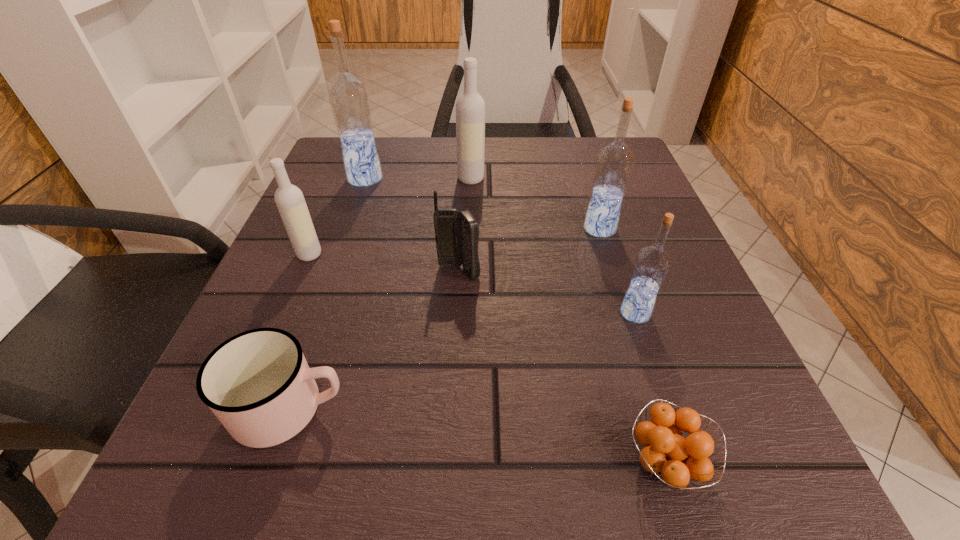
Locate an element on the screen. The width and height of the screenshot is (960, 540). cellular telephone is located at coordinates (457, 233).

I want to click on the second shortest object, so click(x=258, y=384).

At what (x,y) coordinates should I click in order to perform the action: click on the shortest object. Please return your answer as a coordinate pair (x, y). Image resolution: width=960 pixels, height=540 pixels. Looking at the image, I should click on (673, 459).

What are the coordinates of `orange orange fruit` in the screenshot? It's located at (673, 459).

This screenshot has width=960, height=540. I want to click on free spot located 0.360m on the right of the biggest blue vodka, so click(554, 179).

Find the location of a particular element. The height and width of the screenshot is (540, 960). vacant area situated on the left of the right white vodka is located at coordinates (363, 178).

Where is `vacant area situated on the back of the sixth nearest object`? The height and width of the screenshot is (540, 960). vacant area situated on the back of the sixth nearest object is located at coordinates (579, 165).

I want to click on free space located on the right of the second nearest vodka, so click(468, 254).

At what (x,y) coordinates should I click in order to perform the action: click on vacant space located 0.400m on the back of the nearest vodka. Please return your answer as a coordinate pair (x, y). Image resolution: width=960 pixels, height=540 pixels. Looking at the image, I should click on (587, 167).

The image size is (960, 540). I want to click on free location located 0.340m on the keyboard of the cellular telephone, so click(446, 509).